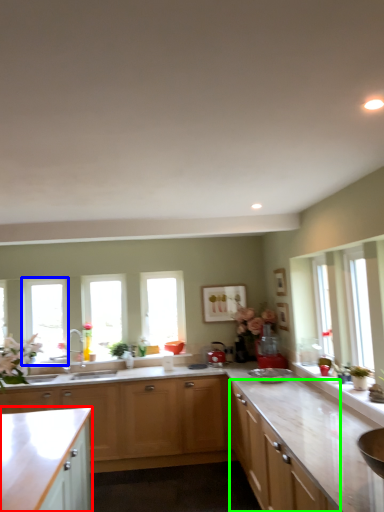
Question: Based on their relative distances, which object is nearer to cabinetry (highlighted by a red box)? Choose from window (highlighted by a blue box) and cabinetry (highlighted by a green box).

Choices:
 (A) window
 (B) cabinetry

Answer: (B)